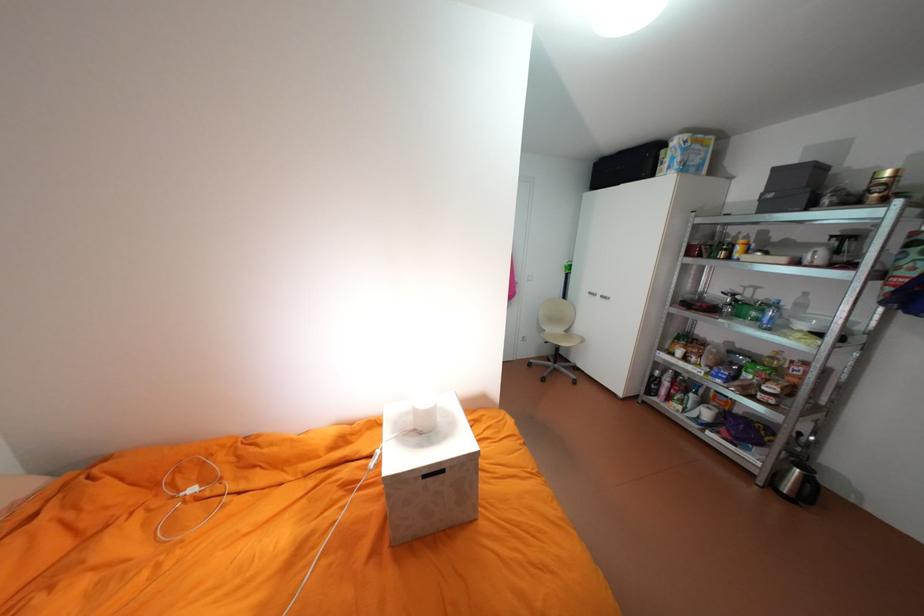
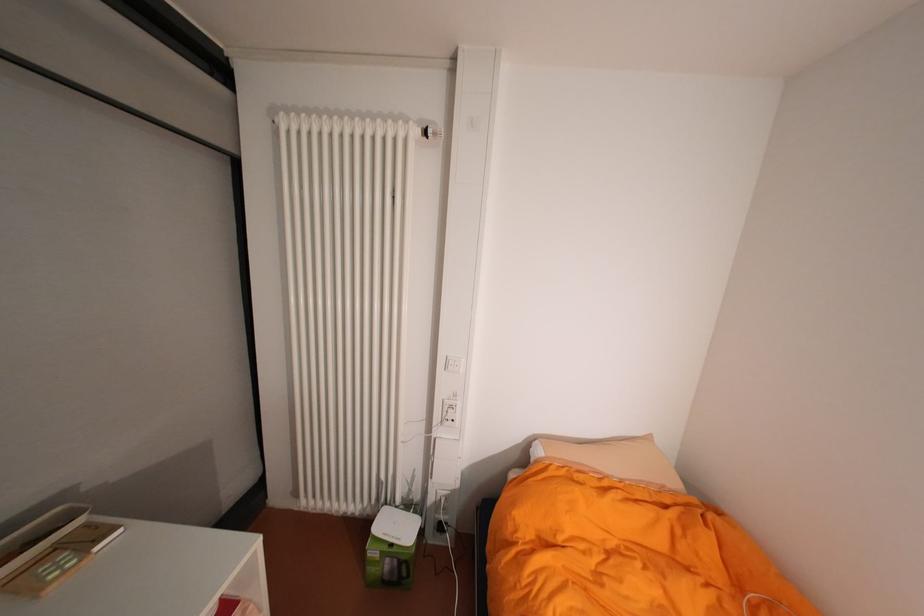
Question: The images are taken continuously from a first-person perspective. In which direction is your viewpoint rotating?

Choices:
 (A) Left
 (B) Right
 (C) Up
 (D) Down

Answer: (A)